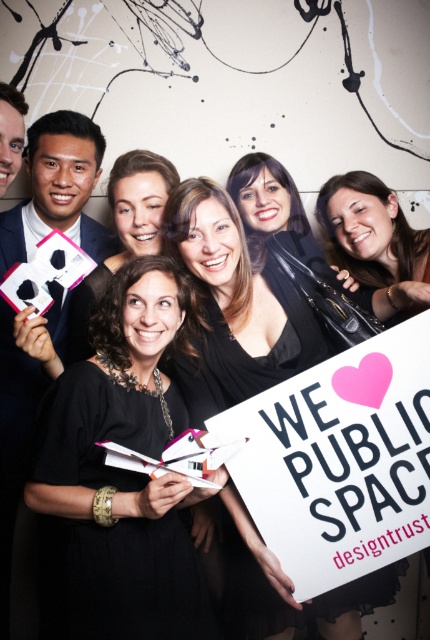
You are a photographer trying to capture the black matte dress at center and the white paper sign at center clearly in a photo. Which object should you focus on first to ensure both are in sharp focus?

The black matte dress at center is in front of the white paper sign at center, so you should focus on the black matte dress at center first to ensure both are in sharp focus.

You are a photographer trying to capture a clear shot of the matte black hair at center and the black matte sign at center. Which object is closer to the camera?

The black matte sign at center is closer to the camera than the matte black hair at center, since the matte black hair at center is positioned behind the sign.